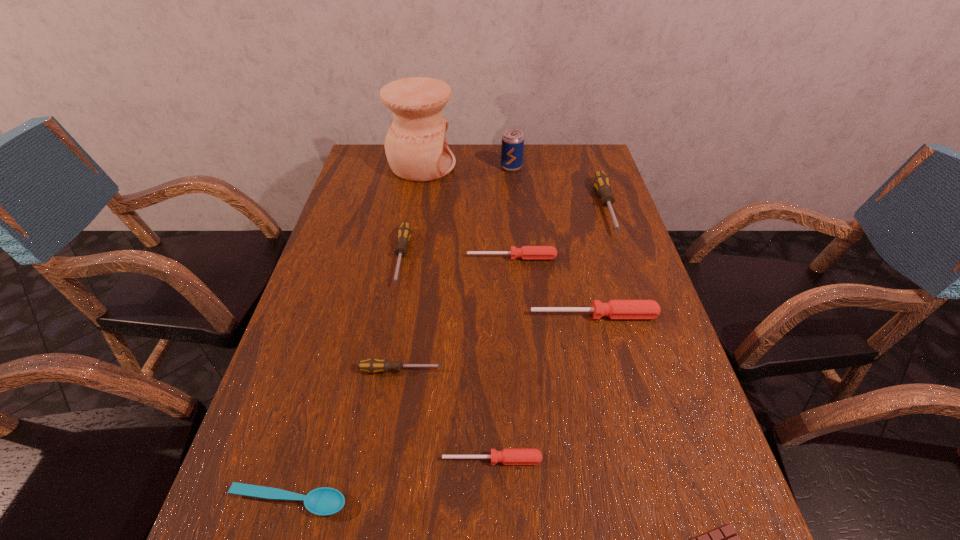
At what (x,y) coordinates should I click in order to perform the action: click on the seventh farthest object. Please return your answer as a coordinate pair (x, y). Looking at the image, I should click on (373, 365).

Locate an element on the screen. the third nearest object is located at coordinates (508, 456).

What are the coordinates of `the nearest screwdriver` in the screenshot? It's located at click(x=508, y=456).

Image resolution: width=960 pixels, height=540 pixels. I want to click on spoon, so click(324, 501).

At what (x,y) coordinates should I click in order to perform the action: click on the second nearest object. Please return your answer as a coordinate pair (x, y). Looking at the image, I should click on (324, 501).

Image resolution: width=960 pixels, height=540 pixels. I want to click on free location located 0.270m at the open side of the tallest object, so click(535, 165).

You are a GUI agent. You are given a task and a screenshot of the screen. Output one action in this format:
    pyautogui.click(x=<x>, y=<y>)
    Task: Click on the free space located 0.180m on the right of the beer can
    The height and width of the screenshot is (540, 960).
    Given the screenshot: What is the action you would take?
    pyautogui.click(x=575, y=167)

Where is `free space located 0.330m at the tip of the tallest screwdriver`? free space located 0.330m at the tip of the tallest screwdriver is located at coordinates (649, 333).

I want to click on free space located at the tip of the second smallest gray screwdriver, so click(373, 408).

I want to click on vacant region located 0.220m on the left of the fifth nearest object, so click(x=437, y=315).